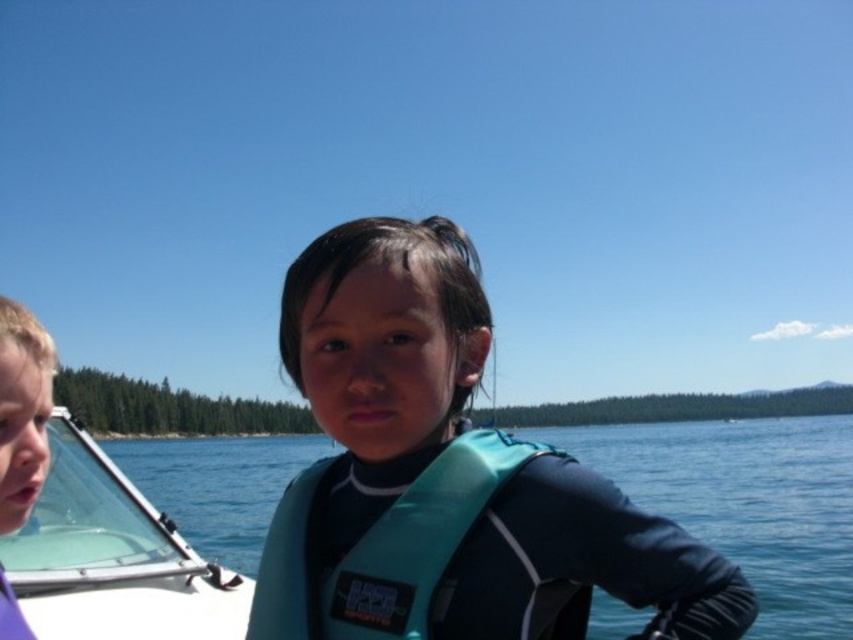
Can you confirm if teal fabric life vest at center is positioned to the right of matte purple shirt at left?

Yes, teal fabric life vest at center is to the right of matte purple shirt at left.

Can you confirm if teal fabric life vest at center is positioned to the left of matte purple shirt at left?

Incorrect, teal fabric life vest at center is not on the left side of matte purple shirt at left.

Where is `teal fabric life vest at center`? This screenshot has width=853, height=640. teal fabric life vest at center is located at coordinates (447, 476).

Is teal fabric life vest at center taller than teal fabric life jacket at center?

Indeed, teal fabric life vest at center has a greater height compared to teal fabric life jacket at center.

Is teal fabric life vest at center to the right of teal fabric life jacket at center from the viewer's perspective?

Correct, you'll find teal fabric life vest at center to the right of teal fabric life jacket at center.

The image size is (853, 640). What do you see at coordinates (447, 476) in the screenshot?
I see `teal fabric life vest at center` at bounding box center [447, 476].

Locate an element on the screen. This screenshot has width=853, height=640. teal fabric life vest at center is located at coordinates (447, 476).

Does teal life vest at center have a larger size compared to teal fabric life jacket at center?

Yes, teal life vest at center is bigger than teal fabric life jacket at center.

Is point (270, 456) closer to viewer compared to point (259, 634)?

No, (270, 456) is behind (259, 634).

Image resolution: width=853 pixels, height=640 pixels. Identify the location of teal life vest at center. (749, 504).